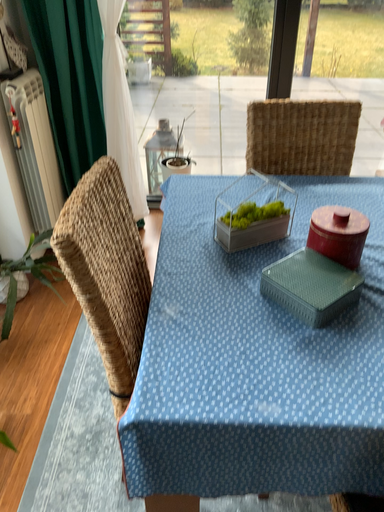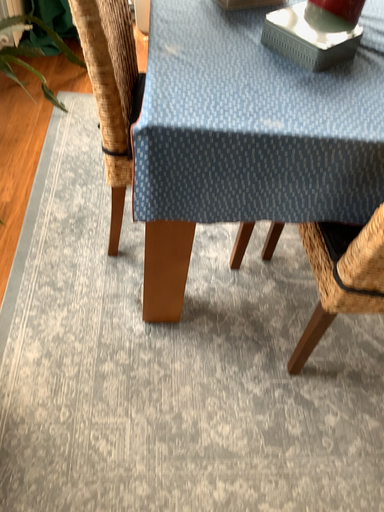
Question: How did the camera likely rotate when shooting the video?

Choices:
 (A) rotated downward
 (B) rotated upward

Answer: (A)